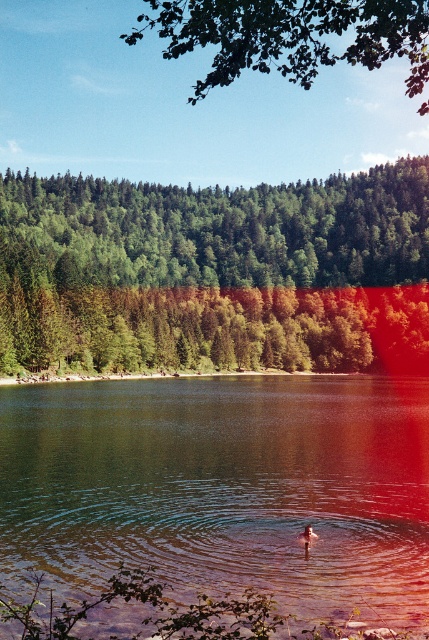
This screenshot has width=429, height=640. What do you see at coordinates (223, 488) in the screenshot?
I see `clear water at center` at bounding box center [223, 488].

In the scene shown: How far apart are clear water at center and green leafy tree at upper center?

clear water at center and green leafy tree at upper center are 103.51 meters apart.

Where is `clear water at center`? The image size is (429, 640). clear water at center is located at coordinates (223, 488).

Between point (151, 444) and point (111, 356), which one is positioned in front?

Point (151, 444) is in front.

Can you confirm if clear water at center is positioned to the left of green matte tree at center?

Incorrect, clear water at center is not on the left side of green matte tree at center.

Who is more distant from viewer, (139, 468) or (325, 300)?

The point (325, 300) is behind.

Find the location of a particular element. clear water at center is located at coordinates (223, 488).

In the scene shown: Is green matte tree at center below green leafy tree at upper center?

Correct, green matte tree at center is located below green leafy tree at upper center.

Which of these two, green matte tree at center or green leafy tree at upper center, stands shorter?

Standing shorter between the two is green matte tree at center.

Between point (196, 337) and point (344, 54), which one is positioned in front?

Point (344, 54)

This screenshot has height=640, width=429. What are the coordinates of `green matte tree at center` in the screenshot? It's located at (215, 273).